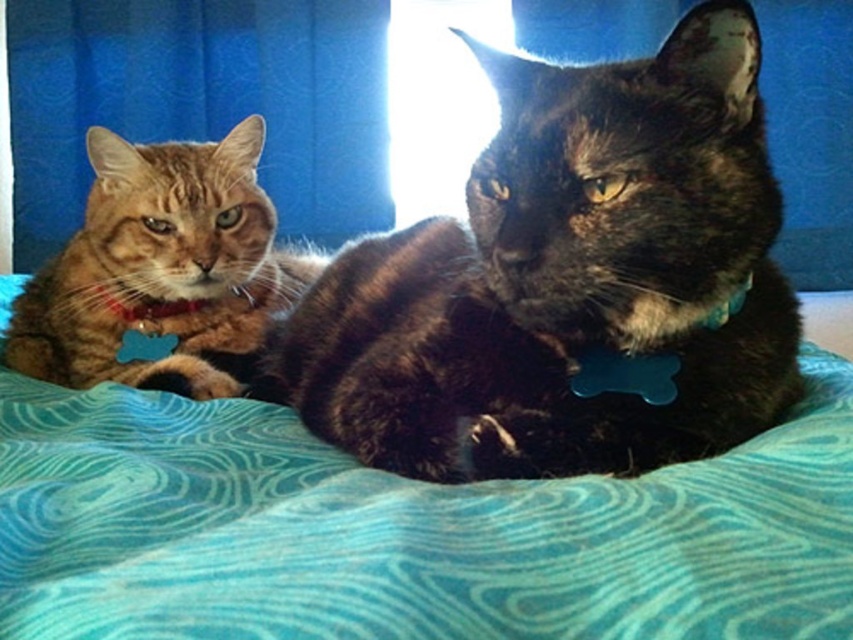
Can you confirm if shiny tortoiseshell cat at center is taller than orange tabby cat at left?

No.

Is point (520, 204) in front of point (296, 285)?

That is True.

Where is `shiny tortoiseshell cat at center`? shiny tortoiseshell cat at center is located at coordinates (566, 280).

The width and height of the screenshot is (853, 640). What are the coordinates of `teal fabric blanket at center` in the screenshot? It's located at (404, 531).

Is teal fabric blanket at center further to camera compared to shiny tortoiseshell cat at center?

No, it is not.

In order to click on teal fabric blanket at center in this screenshot , I will do `click(404, 531)`.

Is shiny tortoiseshell cat at center further to camera compared to matte blue curtain at left?

No, shiny tortoiseshell cat at center is in front of matte blue curtain at left.

Can you confirm if shiny tortoiseshell cat at center is shorter than matte blue curtain at left?

Indeed, shiny tortoiseshell cat at center has a lesser height compared to matte blue curtain at left.

Is point (749, 176) closer to camera compared to point (378, 157)?

Yes, it is.

At what (x,y) coordinates should I click in order to perform the action: click on shiny tortoiseshell cat at center. Please return your answer as a coordinate pair (x, y). The height and width of the screenshot is (640, 853). Looking at the image, I should click on (566, 280).